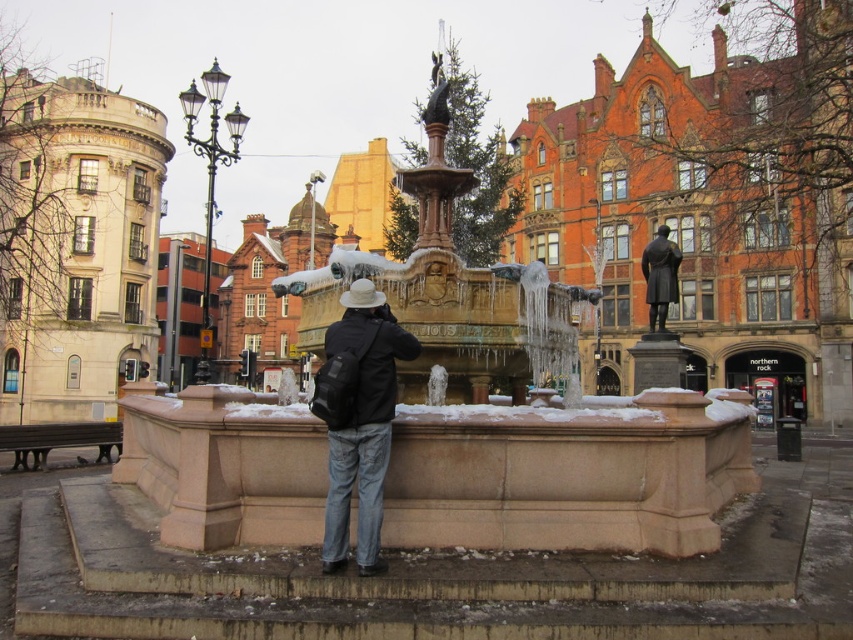
Can you confirm if black matte jacket at center is positioned above black polished statue at center?

Incorrect, black matte jacket at center is not positioned above black polished statue at center.

From the picture: Between black matte jacket at center and black polished statue at center, which one is positioned lower?

black matte jacket at center

Who is more distant from viewer, (347, 442) or (674, 253)?

Point (674, 253)

Where is `black matte jacket at center`? black matte jacket at center is located at coordinates (358, 420).